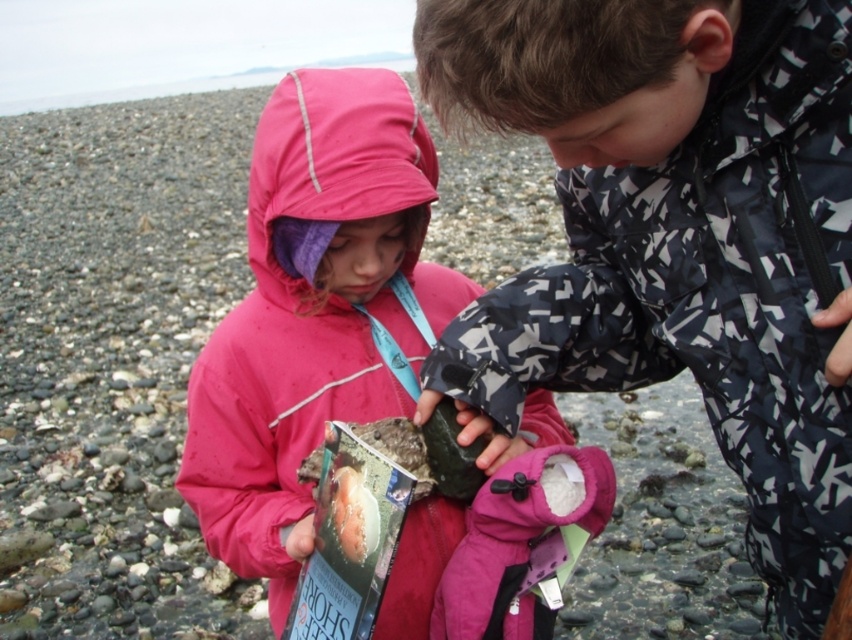
Question: Is camouflage-patterned jacket at center bigger than pink fleece jacket at center?

Choices:
 (A) yes
 (B) no

Answer: (B)

Question: Among these points, which one is farthest from the camera?

Choices:
 (A) (332, 168)
 (B) (543, 81)

Answer: (A)

Question: Does camouflage-patterned jacket at center have a lesser width compared to pink fleece jacket at center?

Choices:
 (A) no
 (B) yes

Answer: (B)

Question: Is camouflage-patterned jacket at center positioned behind pink fleece jacket at center?

Choices:
 (A) no
 (B) yes

Answer: (A)